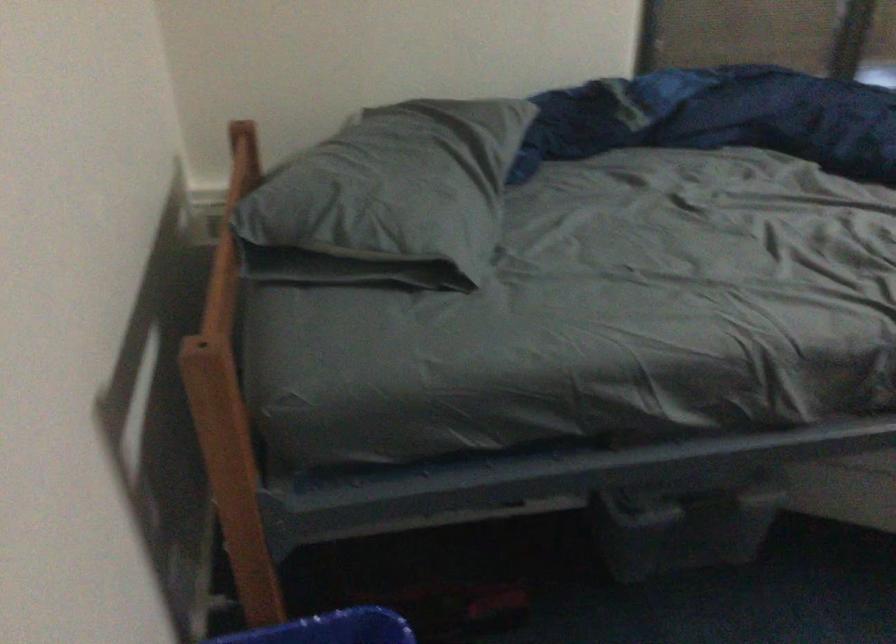
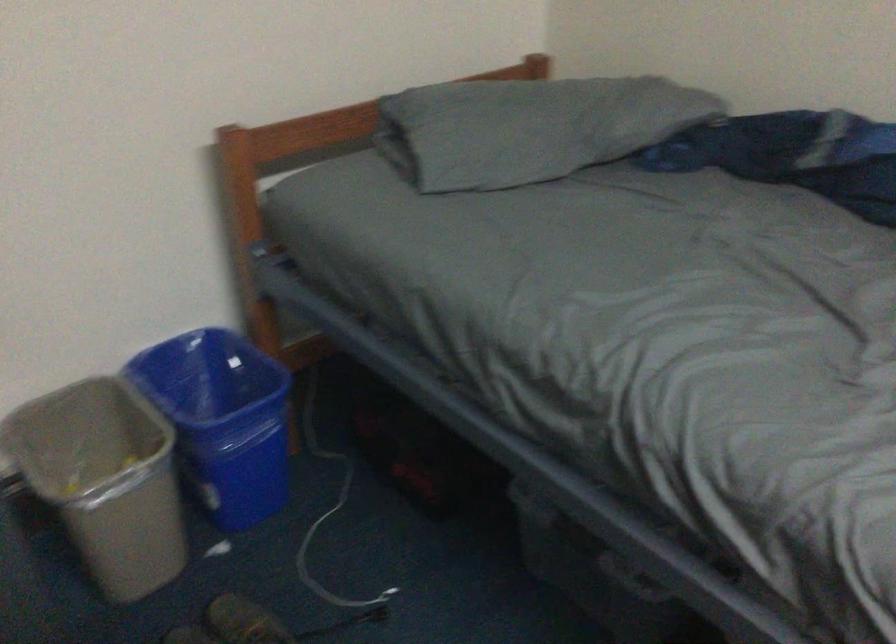
The point at (440,185) is marked in the first image. Where is the corresponding point in the second image?

(529, 128)